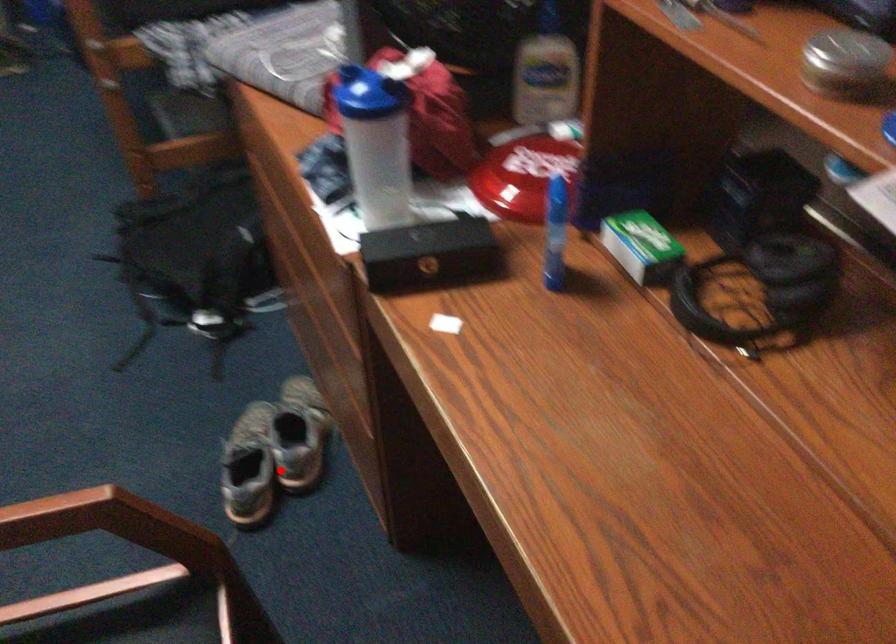
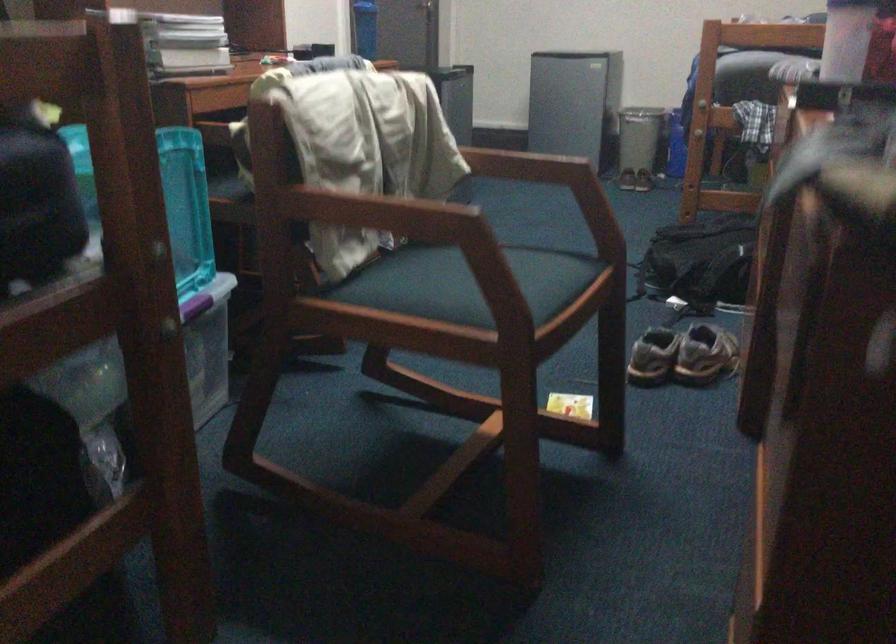
The point at the highlighted location is marked in the first image. Where is the corresponding point in the second image?

(682, 355)